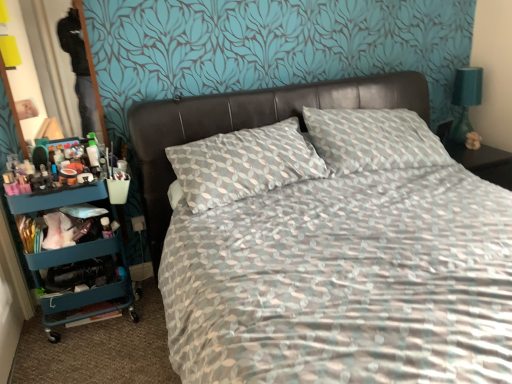
Question: Would you say teal fabric lampshade at right is part of leather at center's contents?

Choices:
 (A) no
 (B) yes

Answer: (A)

Question: Is leather at center to the right of teal fabric lampshade at right from the viewer's perspective?

Choices:
 (A) no
 (B) yes

Answer: (A)

Question: Considering the relative sizes of leather at center and teal fabric lampshade at right in the image provided, is leather at center thinner than teal fabric lampshade at right?

Choices:
 (A) no
 (B) yes

Answer: (A)

Question: Does leather at center have a greater height compared to teal fabric lampshade at right?

Choices:
 (A) no
 (B) yes

Answer: (B)

Question: Is leather at center turned away from teal fabric lampshade at right?

Choices:
 (A) yes
 (B) no

Answer: (B)

Question: From a real-world perspective, is leather at center positioned under teal fabric lampshade at right based on gravity?

Choices:
 (A) no
 (B) yes

Answer: (B)

Question: Considering the relative positions of teal plastic cart at left and leather at center in the image provided, is teal plastic cart at left to the left of leather at center from the viewer's perspective?

Choices:
 (A) no
 (B) yes

Answer: (B)

Question: From the image's perspective, does teal plastic cart at left appear lower than leather at center?

Choices:
 (A) no
 (B) yes

Answer: (B)

Question: Considering the relative sizes of teal plastic cart at left and leather at center in the image provided, is teal plastic cart at left wider than leather at center?

Choices:
 (A) yes
 (B) no

Answer: (B)

Question: Can you confirm if teal plastic cart at left is positioned to the right of leather at center?

Choices:
 (A) yes
 (B) no

Answer: (B)

Question: Can you confirm if teal plastic cart at left is taller than leather at center?

Choices:
 (A) yes
 (B) no

Answer: (A)

Question: Is teal plastic cart at left directly adjacent to leather at center?

Choices:
 (A) no
 (B) yes

Answer: (A)

Question: Considering the relative sizes of leather at center and teal plastic cart at left in the image provided, is leather at center thinner than teal plastic cart at left?

Choices:
 (A) yes
 (B) no

Answer: (B)